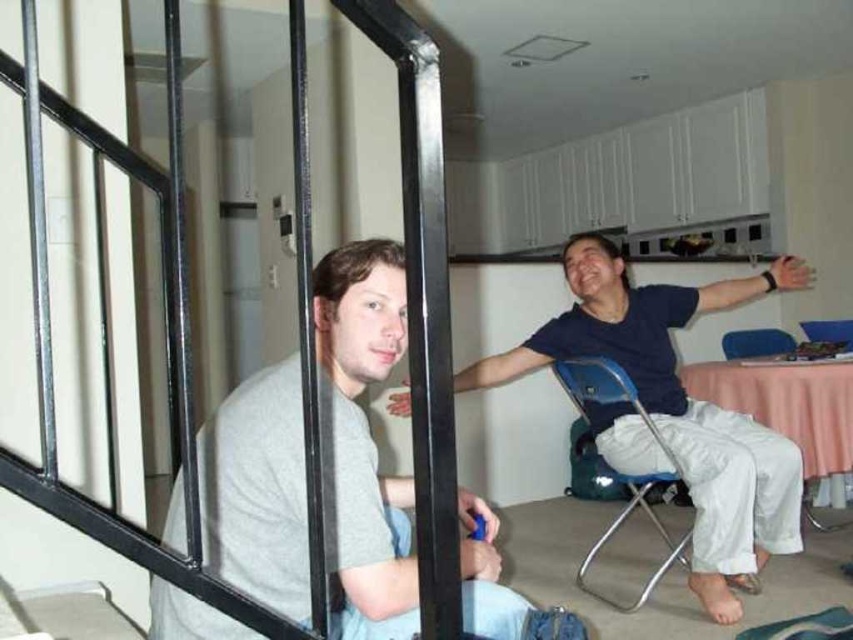
Question: Which of the following is the farthest from the observer?

Choices:
 (A) (633, 486)
 (B) (775, 352)
 (C) (281, 444)
 (D) (590, 342)

Answer: (B)

Question: Which is farther from the gray matte shirt at left?

Choices:
 (A) blue plastic chair at center
 (B) blue cotton shirt at center
 (C) blue plastic chair at right

Answer: (C)

Question: Does gray matte shirt at left have a lesser width compared to blue plastic chair at center?

Choices:
 (A) yes
 (B) no

Answer: (B)

Question: Does gray matte shirt at left have a smaller size compared to blue cotton shirt at center?

Choices:
 (A) no
 (B) yes

Answer: (B)

Question: From the image, what is the correct spatial relationship of blue cotton shirt at center in relation to blue plastic chair at center?

Choices:
 (A) above
 (B) below

Answer: (A)

Question: Considering the real-world distances, which object is farthest from the blue plastic chair at right?

Choices:
 (A) blue cotton shirt at center
 (B) gray matte shirt at left
 (C) blue plastic chair at center

Answer: (B)